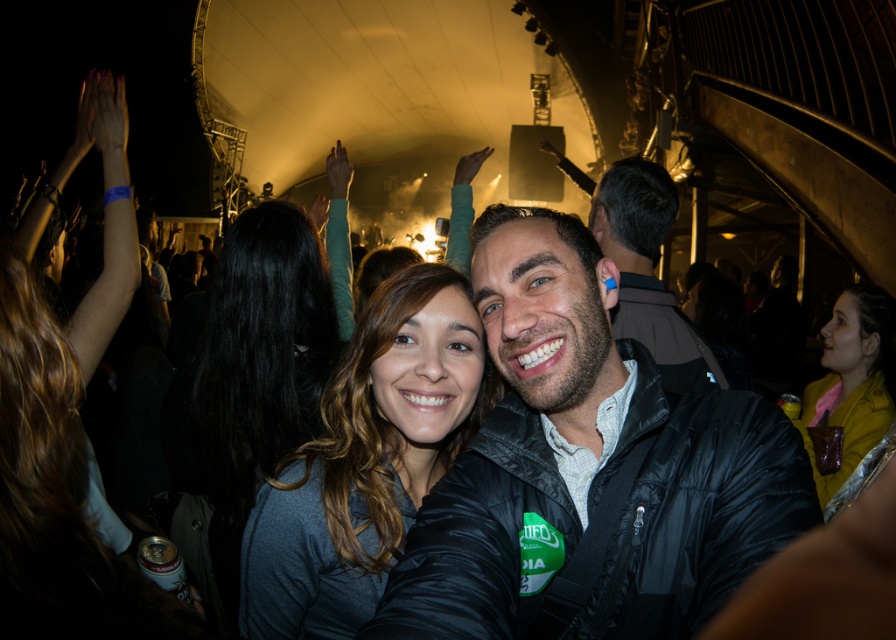
Question: Which of these objects is positioned farthest from the dark gray sweater at center?

Choices:
 (A) black leather jacket at center
 (B) dark gray fabric at center
 (C) dark blue jacket at center
 (D) yellow leather jacket at center

Answer: (D)

Question: Is black leather jacket at center smaller than dark blue jacket at center?

Choices:
 (A) no
 (B) yes

Answer: (B)

Question: Does dark gray fabric at center appear on the right side of dark gray sweater at center?

Choices:
 (A) yes
 (B) no

Answer: (A)

Question: Does dark gray sweater at center have a lesser width compared to dark blue jacket at center?

Choices:
 (A) no
 (B) yes

Answer: (A)

Question: Which point appears closest to the camera in this image?

Choices:
 (A) (421, 440)
 (B) (836, 444)
 (C) (467, 525)
 (D) (621, 232)

Answer: (C)

Question: Which of the following is the closest to the observer?

Choices:
 (A) dark blue jacket at center
 (B) dark gray fabric at center
 (C) black leather jacket at center

Answer: (C)